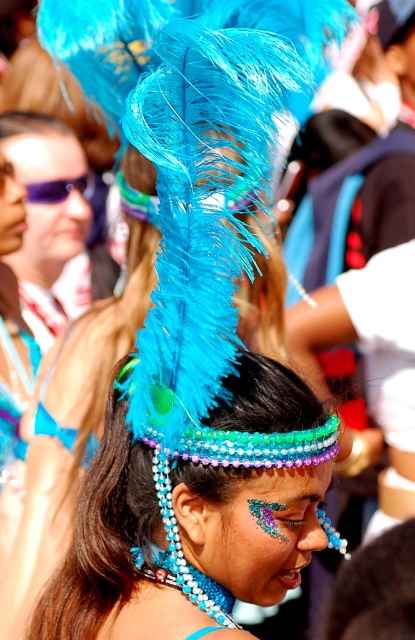
Between shiny blue feather headdress at center and shiny blue feathers at center, which one appears on the left side from the viewer's perspective?

shiny blue feathers at center

Between shiny blue feather headdress at center and shiny blue feathers at center, which one has more height?

With more height is shiny blue feathers at center.

Find the location of a particular element. shiny blue feather headdress at center is located at coordinates (x=102, y=536).

Locate an element on the screen. shiny blue feather headdress at center is located at coordinates (102, 536).

Who is more forward, (292, 422) or (46, 193)?

Point (292, 422)

I want to click on shiny blue feather headdress at center, so click(102, 536).

Between point (53, 452) and point (46, 195), which one is positioned in front?

Point (53, 452) is in front.

This screenshot has height=640, width=415. Describe the element at coordinates (70, 428) in the screenshot. I see `shiny blue feathers at center` at that location.

Locate an element on the screen. This screenshot has width=415, height=640. shiny blue feathers at center is located at coordinates (70, 428).